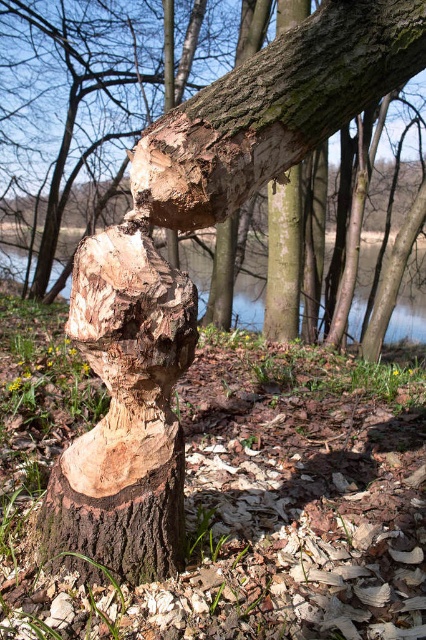
You are standing in the wooded area looking at the tree trunk. Which object is nearer to you between the smooth brown wood at center and the transparent water at center?

The smooth brown wood at center is closer to the viewer than the transparent water at center.

From the picture: You are a nature enthusiast observing the wooded area. You notice the natural wood tree stump at center and the smooth brown wood at center. Which object is positioned to the right side of the other?

The smooth brown wood at center is positioned to the right of the natural wood tree stump at center because the natural wood tree stump at center is to the left of smooth brown wood at center.